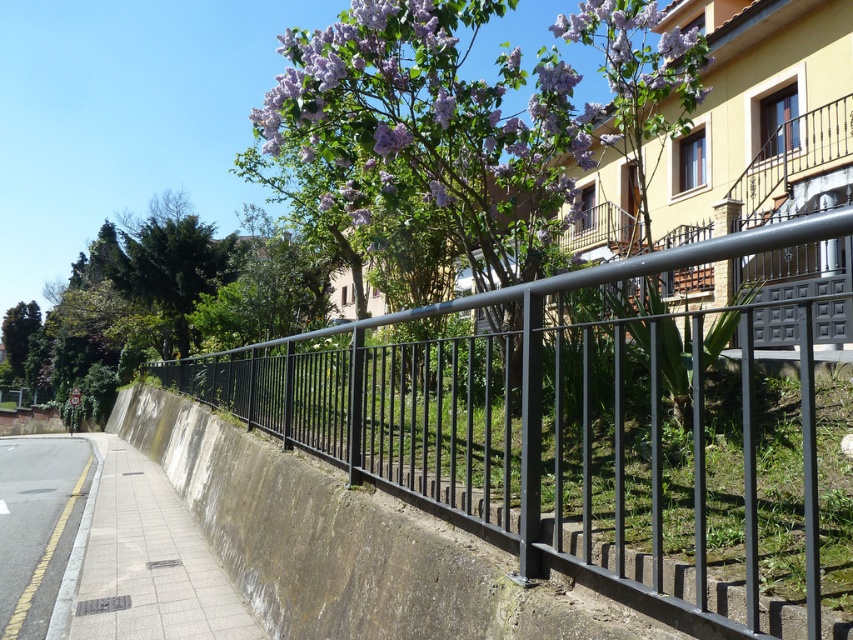
Can you confirm if purple flowering tree at center is shorter than purple matte flower at upper center?

In fact, purple flowering tree at center may be taller than purple matte flower at upper center.

Is purple flowering tree at center positioned behind purple matte flower at upper center?

No, purple flowering tree at center is in front of purple matte flower at upper center.

The width and height of the screenshot is (853, 640). What are the coordinates of `purple flowering tree at center` in the screenshot? It's located at [x=427, y=129].

The height and width of the screenshot is (640, 853). Identify the location of purple flowering tree at center. (427, 129).

Is yellow painted concrete pavement at lower left in front of purple matte flower at upper center?

No, it is behind purple matte flower at upper center.

Is yellow painted concrete pavement at lower left above purple matte flower at upper center?

No.

Is point (39, 506) positioned behind point (444, 104)?

Yes, it is behind point (444, 104).

I want to click on yellow painted concrete pavement at lower left, so click(38, 525).

Is black metal fence at center closer to camera compared to gray concrete pavement at lower left?

Yes, black metal fence at center is closer to the viewer.

Does point (511, 330) come closer to viewer compared to point (141, 580)?

Yes, it is.

Image resolution: width=853 pixels, height=640 pixels. In order to click on black metal fence at center in this screenshot , I will do `click(548, 424)`.